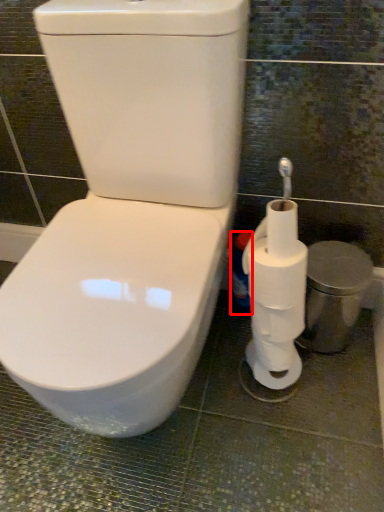
Question: Where is cleaning product (annotated by the red box) located in relation to toilet paper in the image?

Choices:
 (A) left
 (B) right

Answer: (A)